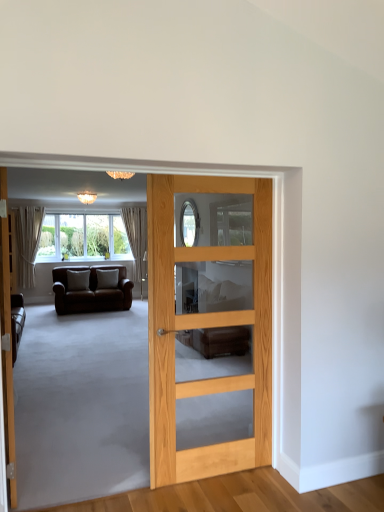
This screenshot has height=512, width=384. I want to click on natural wood door at center, so click(205, 327).

What do you see at coordinates (205, 327) in the screenshot?
I see `natural wood door at center` at bounding box center [205, 327].

Locate an element on the screen. natural wood door at center is located at coordinates (205, 327).